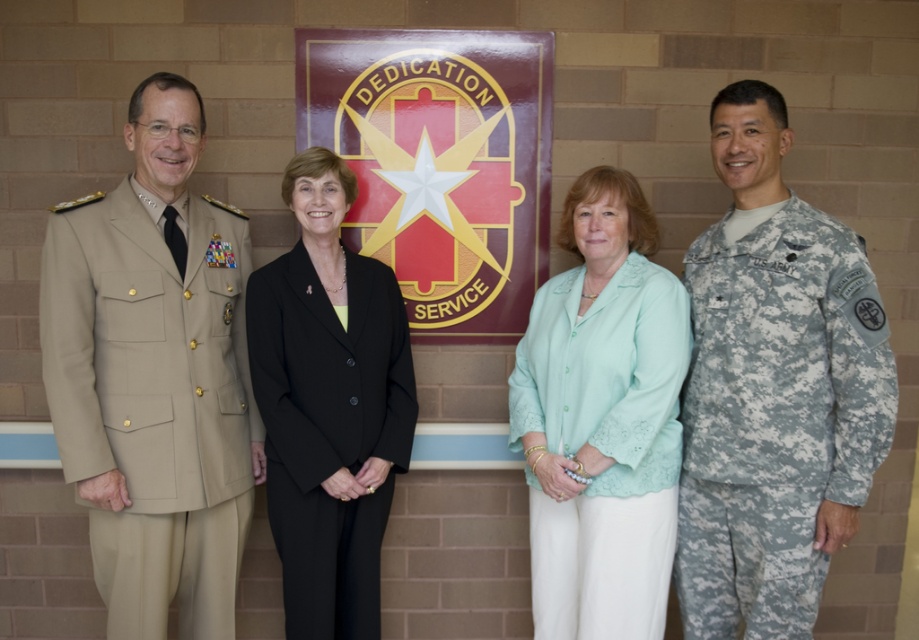
Looking at this image, who is taller, camouflage fabric uniform at right or black fabric suit at center?

Standing taller between the two is camouflage fabric uniform at right.

Is camouflage fabric uniform at right to the right of black fabric suit at center from the viewer's perspective?

Yes, camouflage fabric uniform at right is to the right of black fabric suit at center.

Identify the location of camouflage fabric uniform at right. (775, 417).

Which is more to the left, tan fabric uniform at left or black fabric suit at center?

From the viewer's perspective, tan fabric uniform at left appears more on the left side.

Can you confirm if tan fabric uniform at left is positioned to the right of black fabric suit at center?

In fact, tan fabric uniform at left is to the left of black fabric suit at center.

From the picture: Who is more forward, [64,378] or [354,268]?

Point [64,378] is in front.

Where is `tan fabric uniform at left`? This screenshot has width=919, height=640. tan fabric uniform at left is located at coordinates (154, 400).

Which is behind, point (647, 564) or point (273, 540)?

The point (273, 540) is behind.

Does light green fabric blouse at center appear under black fabric suit at center?

Incorrect, light green fabric blouse at center is not positioned below black fabric suit at center.

Does point (672, 413) lie behind point (251, 364)?

That is False.

Identify the location of light green fabric blouse at center. (602, 419).